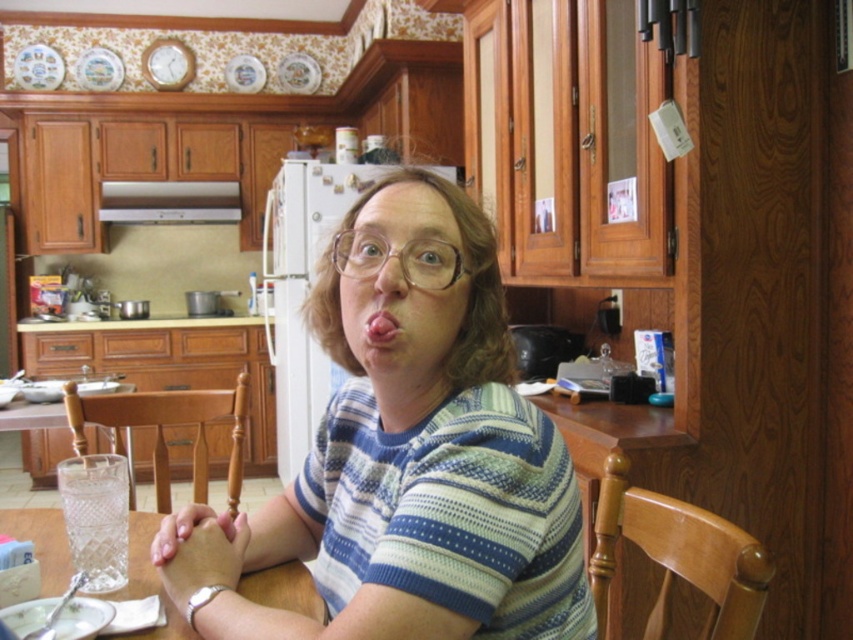
You are a photographer setting up a shoot in the kitchen. You want to focus on the striped cotton shirt at center while keeping the clear glass table at center in the background. Which object should you position closer to the camera lens?

The striped cotton shirt at center should be positioned closer to the camera lens since it is closer to the viewer than the clear glass table at center, allowing it to be in focus while the table remains in the background.